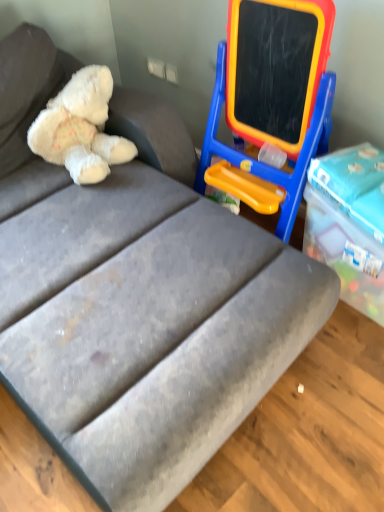
This screenshot has height=512, width=384. Describe the element at coordinates (274, 91) in the screenshot. I see `blue plastic easel at upper right` at that location.

You are a GUI agent. You are given a task and a screenshot of the screen. Output one action in this format:
    pyautogui.click(x=<x>, y=<y>)
    Task: Click on the blue plastic easel at upper right
    
    Given the screenshot: What is the action you would take?
    click(x=274, y=91)

What do you see at coordinates (80, 128) in the screenshot?
I see `white plush teddy bear at upper left` at bounding box center [80, 128].

You are a GUI agent. You are given a task and a screenshot of the screen. Output one action in this format:
    pyautogui.click(x=<x>, y=<y>)
    Task: Click on the white plush teddy bear at upper left
    This screenshot has width=384, height=512.
    Given the screenshot: What is the action you would take?
    pyautogui.click(x=80, y=128)

Identify the location of blue plastic easel at upper right. (274, 91).

Based on their positions, is white plush teddy bear at upper left located to the left or right of blue plastic easel at upper right?

Based on their positions, white plush teddy bear at upper left is located to the left of blue plastic easel at upper right.

Based on the photo, which is behind, white plush teddy bear at upper left or blue plastic easel at upper right?

white plush teddy bear at upper left is more distant.

Which is closer, [42,137] or [225,74]?

Point [42,137] is farther from the camera than point [225,74].

From the image's perspective, is white plush teddy bear at upper left over blue plastic easel at upper right?

Indeed, from the image's perspective, white plush teddy bear at upper left is shown above blue plastic easel at upper right.

From a real-world perspective, is white plush teddy bear at upper left physically above blue plastic easel at upper right?

Yes, from a real-world perspective, white plush teddy bear at upper left is on top of blue plastic easel at upper right.

Considering the sizes of objects white plush teddy bear at upper left and blue plastic easel at upper right in the image provided, who is wider, white plush teddy bear at upper left or blue plastic easel at upper right?

Wider between the two is white plush teddy bear at upper left.

Considering the relative sizes of white plush teddy bear at upper left and blue plastic easel at upper right in the image provided, is white plush teddy bear at upper left taller than blue plastic easel at upper right?

No, white plush teddy bear at upper left is not taller than blue plastic easel at upper right.

Who is bigger, white plush teddy bear at upper left or blue plastic easel at upper right?

Bigger between the two is blue plastic easel at upper right.

Would you say white plush teddy bear at upper left is outside blue plastic easel at upper right?

Yes, white plush teddy bear at upper left is not within blue plastic easel at upper right.

Is white plush teddy bear at upper left next to blue plastic easel at upper right and touching it?

There is a gap between white plush teddy bear at upper left and blue plastic easel at upper right.

Is blue plastic easel at upper right at the back of white plush teddy bear at upper left?

No, white plush teddy bear at upper left is not facing the opposite direction of blue plastic easel at upper right.

Where is `equipment lying below the white plush teddy bear at upper left (from the image's perspective)`? equipment lying below the white plush teddy bear at upper left (from the image's perspective) is located at coordinates (274, 91).

Which object is positioned more to the right, blue plastic easel at upper right or white plush teddy bear at upper left?

blue plastic easel at upper right is more to the right.

Is blue plastic easel at upper right further to the viewer compared to white plush teddy bear at upper left?

No.

Looking at this image, which is closer to the camera, [235,29] or [88,109]?

Point [235,29].

From the image's perspective, is blue plastic easel at upper right above or below white plush teddy bear at upper left?

blue plastic easel at upper right is below white plush teddy bear at upper left.

From a real-world perspective, is blue plastic easel at upper right beneath white plush teddy bear at upper left?

Yes, from a real-world perspective, blue plastic easel at upper right is under white plush teddy bear at upper left.

Can you confirm if blue plastic easel at upper right is wider than white plush teddy bear at upper left?

No, blue plastic easel at upper right is not wider than white plush teddy bear at upper left.

Between blue plastic easel at upper right and white plush teddy bear at upper left, which one has more height?

blue plastic easel at upper right.

Considering the sizes of objects blue plastic easel at upper right and white plush teddy bear at upper left in the image provided, who is smaller, blue plastic easel at upper right or white plush teddy bear at upper left?

With smaller size is white plush teddy bear at upper left.

Is blue plastic easel at upper right not within white plush teddy bear at upper left?

blue plastic easel at upper right lies outside white plush teddy bear at upper left's area.

Is blue plastic easel at upper right not near white plush teddy bear at upper left?

blue plastic easel at upper right is actually quite close to white plush teddy bear at upper left.

Is blue plastic easel at upper right facing away from white plush teddy bear at upper left?

blue plastic easel at upper right does not have its back to white plush teddy bear at upper left.

Measure the distance from blue plastic easel at upper right to white plush teddy bear at upper left.

blue plastic easel at upper right is 22.84 inches away from white plush teddy bear at upper left.

You are a GUI agent. You are given a task and a screenshot of the screen. Output one action in this format:
    pyautogui.click(x=<x>, y=<y>)
    Task: Click on the equipment in front of the white plush teddy bear at upper left
    This screenshot has height=512, width=384.
    Given the screenshot: What is the action you would take?
    pyautogui.click(x=274, y=91)

Locate an element on the screen. teddy bear that is above the blue plastic easel at upper right (from a real-world perspective) is located at coordinates (80, 128).

Locate an element on the screen. equipment below the white plush teddy bear at upper left (from a real-world perspective) is located at coordinates (274, 91).